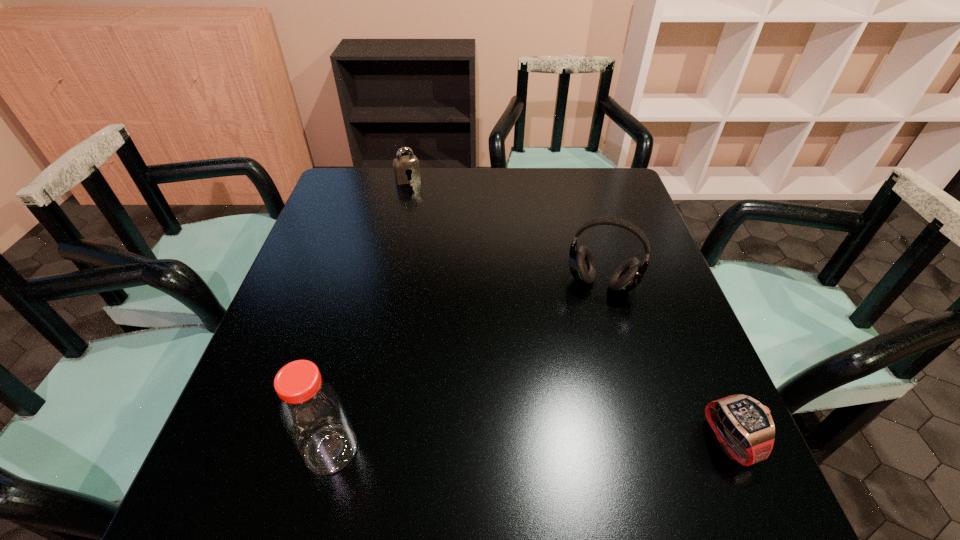
This screenshot has width=960, height=540. I want to click on vacant point located between the padlock and the rightmost object, so click(569, 310).

At what (x,y) coordinates should I click in order to perform the action: click on vacant area that lies between the shortest object and the headset. Please return your answer as a coordinate pair (x, y). The image size is (960, 540). Looking at the image, I should click on (665, 362).

Where is `vacant space that is in between the bottle and the second farthest object`? vacant space that is in between the bottle and the second farthest object is located at coordinates (467, 366).

At what (x,y) coordinates should I click in order to perform the action: click on unoccupied position between the third object from left to right and the bottle. Please return your answer as a coordinate pair (x, y). The image size is (960, 540). Looking at the image, I should click on (467, 366).

Find the location of a particular element. vacant space that is in between the shortest object and the farthest object is located at coordinates (569, 310).

Image resolution: width=960 pixels, height=540 pixels. What are the coordinates of `vacant area that lies between the third object from left to right and the bottle` in the screenshot? It's located at (467, 366).

Identify the location of vacant region between the padlock and the watch. Image resolution: width=960 pixels, height=540 pixels. (569, 310).

Where is `unoccupied area between the bottle and the padlock`? The width and height of the screenshot is (960, 540). unoccupied area between the bottle and the padlock is located at coordinates (370, 314).

Where is `object that ranks as the closest to the bottle`? object that ranks as the closest to the bottle is located at coordinates (628, 275).

Identify which object is the third nearest to the second farthest object. Please provide its 2D coordinates. Your answer should be formatted as a tuple, i.e. [(x, y)], where the tuple contains the x and y coordinates of a point satisfying the conditions above.

[(406, 167)]